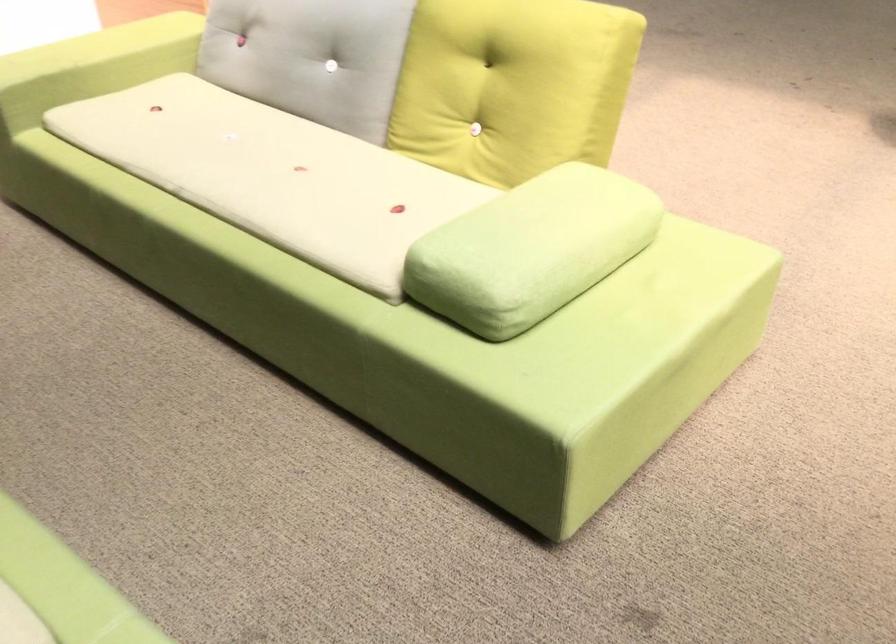
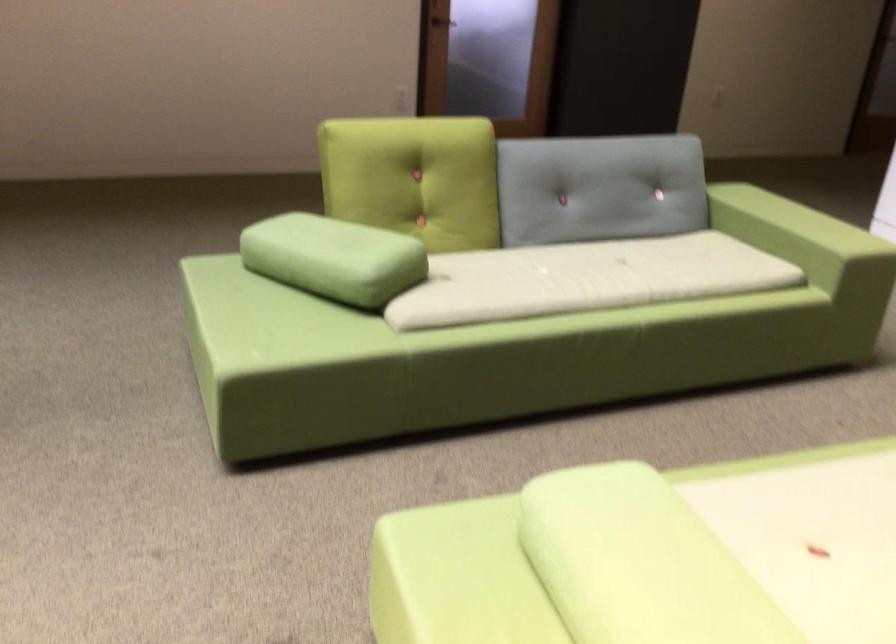
The point at [554,218] is marked in the first image. Where is the corresponding point in the second image?

(639, 563)